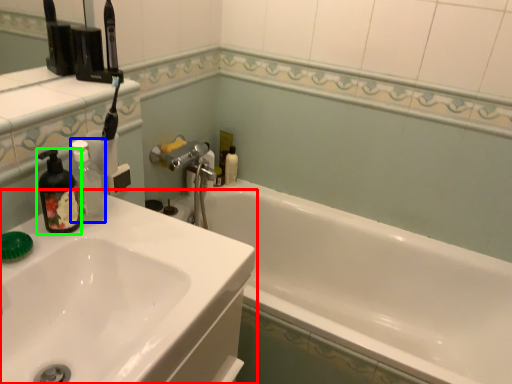
Question: Based on their relative distances, which object is farther from sink (highlighted by a red box)? Choose from bottle (highlighted by a blue box) and soap dispenser (highlighted by a green box).

Choices:
 (A) bottle
 (B) soap dispenser

Answer: (A)